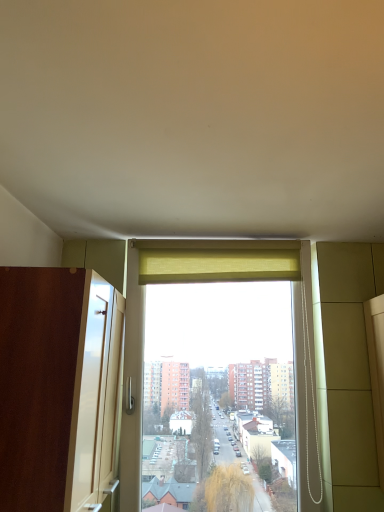
What do you see at coordinates (218, 265) in the screenshot? The width and height of the screenshot is (384, 512). I see `yellow fabric curtain at upper center` at bounding box center [218, 265].

Based on the photo, in order to face yellow fabric curtain at upper center, should I rotate leftwards or rightwards?

It's best to rotate right around 3.333 degrees.

This screenshot has width=384, height=512. In order to click on yellow fabric curtain at upper center in this screenshot , I will do `click(218, 265)`.

The height and width of the screenshot is (512, 384). What do you see at coordinates (58, 387) in the screenshot? I see `brown wood screen door at left` at bounding box center [58, 387].

The height and width of the screenshot is (512, 384). Find the location of `brown wood screen door at left`. brown wood screen door at left is located at coordinates (58, 387).

In the scene shown: Measure the distance between brown wood screen door at left and camera.

The distance of brown wood screen door at left from camera is 1.07 meters.

Locate an element on the screen. Image resolution: width=384 pixels, height=512 pixels. yellow fabric curtain at upper center is located at coordinates (218, 265).

From the picture: Which is more to the left, yellow fabric curtain at upper center or brown wood screen door at left?

brown wood screen door at left is more to the left.

Looking at this image, which is behind, yellow fabric curtain at upper center or brown wood screen door at left?

yellow fabric curtain at upper center is further away from the camera.

Considering the points (246, 260) and (93, 406), which point is in front, point (246, 260) or point (93, 406)?

The point (93, 406) is closer.

From the image's perspective, is yellow fabric curtain at upper center under brown wood screen door at left?

Incorrect, from the image's perspective, yellow fabric curtain at upper center is higher than brown wood screen door at left.

In the scene shown: From a real-world perspective, which is physically below, yellow fabric curtain at upper center or brown wood screen door at left?

brown wood screen door at left is physically lower.

Between yellow fabric curtain at upper center and brown wood screen door at left, which one has smaller width?

With smaller width is yellow fabric curtain at upper center.

Between yellow fabric curtain at upper center and brown wood screen door at left, which one has less height?

Standing shorter between the two is yellow fabric curtain at upper center.

Which of these two, yellow fabric curtain at upper center or brown wood screen door at left, is bigger?

Bigger between the two is brown wood screen door at left.

Which is correct: yellow fabric curtain at upper center is inside brown wood screen door at left, or outside of it?

yellow fabric curtain at upper center cannot be found inside brown wood screen door at left.

In the scene shown: Is yellow fabric curtain at upper center far away from brown wood screen door at left?

yellow fabric curtain at upper center is near brown wood screen door at left, not far away.

From the picture: Does yellow fabric curtain at upper center turn towards brown wood screen door at left?

No, yellow fabric curtain at upper center is not turned towards brown wood screen door at left.

Find the location of a particular element. The image size is (384, 512). screen door on the left of yellow fabric curtain at upper center is located at coordinates (58, 387).

Which object is positioned more to the right, brown wood screen door at left or yellow fabric curtain at upper center?

Positioned to the right is yellow fabric curtain at upper center.

Does brown wood screen door at left lie in front of yellow fabric curtain at upper center?

Yes, brown wood screen door at left is closer to the camera.

Considering the positions of point (74, 345) and point (169, 263), is point (74, 345) closer or farther from the camera than point (169, 263)?

Clearly, point (74, 345) is closer to the camera than point (169, 263).

From the image's perspective, is brown wood screen door at left over yellow fabric curtain at upper center?

No, from the image's perspective, brown wood screen door at left is not above yellow fabric curtain at upper center.

From a real-world perspective, between brown wood screen door at left and yellow fabric curtain at upper center, who is vertically higher?

yellow fabric curtain at upper center.

Is brown wood screen door at left thinner than yellow fabric curtain at upper center?

In fact, brown wood screen door at left might be wider than yellow fabric curtain at upper center.

From their relative heights in the image, would you say brown wood screen door at left is taller or shorter than yellow fabric curtain at upper center?

brown wood screen door at left is taller than yellow fabric curtain at upper center.

Who is smaller, brown wood screen door at left or yellow fabric curtain at upper center?

Smaller between the two is yellow fabric curtain at upper center.

Can yellow fabric curtain at upper center be found inside brown wood screen door at left?

That's incorrect, yellow fabric curtain at upper center is not inside brown wood screen door at left.

Is brown wood screen door at left not near yellow fabric curtain at upper center?

No, brown wood screen door at left is in close proximity to yellow fabric curtain at upper center.

Is brown wood screen door at left looking in the opposite direction of yellow fabric curtain at upper center?

No.

How different are the orientations of brown wood screen door at left and yellow fabric curtain at upper center in degrees?

The angular difference between brown wood screen door at left and yellow fabric curtain at upper center is 90.1 degrees.

How far apart are brown wood screen door at left and yellow fabric curtain at upper center?

A distance of 22.33 inches exists between brown wood screen door at left and yellow fabric curtain at upper center.

Where is `screen door directly beneath the yellow fabric curtain at upper center (from a real-world perspective)`? The image size is (384, 512). screen door directly beneath the yellow fabric curtain at upper center (from a real-world perspective) is located at coordinates (58, 387).

The height and width of the screenshot is (512, 384). Find the location of `curtain that appears above the brown wood screen door at left (from the image's perspective)`. curtain that appears above the brown wood screen door at left (from the image's perspective) is located at coordinates (218, 265).

Where is `curtain lying on the right of brown wood screen door at left`? Image resolution: width=384 pixels, height=512 pixels. curtain lying on the right of brown wood screen door at left is located at coordinates (218, 265).